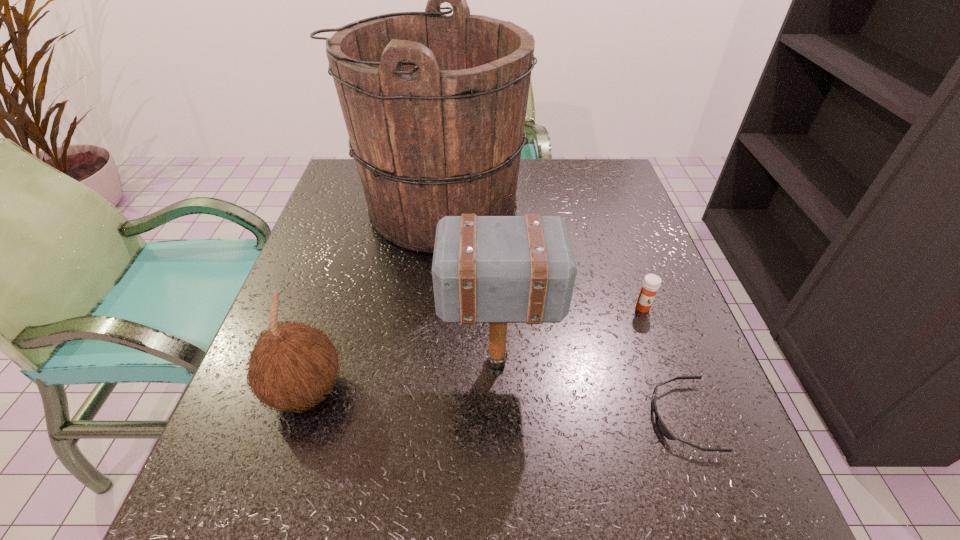
This screenshot has width=960, height=540. I want to click on sunglasses positioned at the right edge, so click(x=660, y=425).

Identify the location of object located in the far left corner section of the desktop. This screenshot has width=960, height=540. (434, 105).

Image resolution: width=960 pixels, height=540 pixels. In the image, there is a desktop. What are the coordinates of `vacant space at the far edge` in the screenshot? It's located at (524, 173).

At what (x,y) coordinates should I click in order to perform the action: click on vacant space at the near edge of the desktop. Please return your answer as a coordinate pair (x, y). Image resolution: width=960 pixels, height=540 pixels. Looking at the image, I should click on (319, 521).

Image resolution: width=960 pixels, height=540 pixels. Identify the location of blank space at the left edge of the desktop. (323, 267).

Identify the location of vacant space at the right edge of the desktop. (605, 301).

Locate an element on the screen. This screenshot has height=540, width=960. vacant space at the far left corner of the desktop is located at coordinates (362, 194).

Find the location of a particular element. The image size is (960, 540). free spot at the far right corner of the desktop is located at coordinates (609, 199).

Identify the location of vacant space at the near right corner. The width and height of the screenshot is (960, 540). (761, 520).

At what (x,y) coordinates should I click in order to perform the action: click on free space that is in between the sunglasses and the medicine. Please return your answer as a coordinate pair (x, y). Looking at the image, I should click on (662, 362).